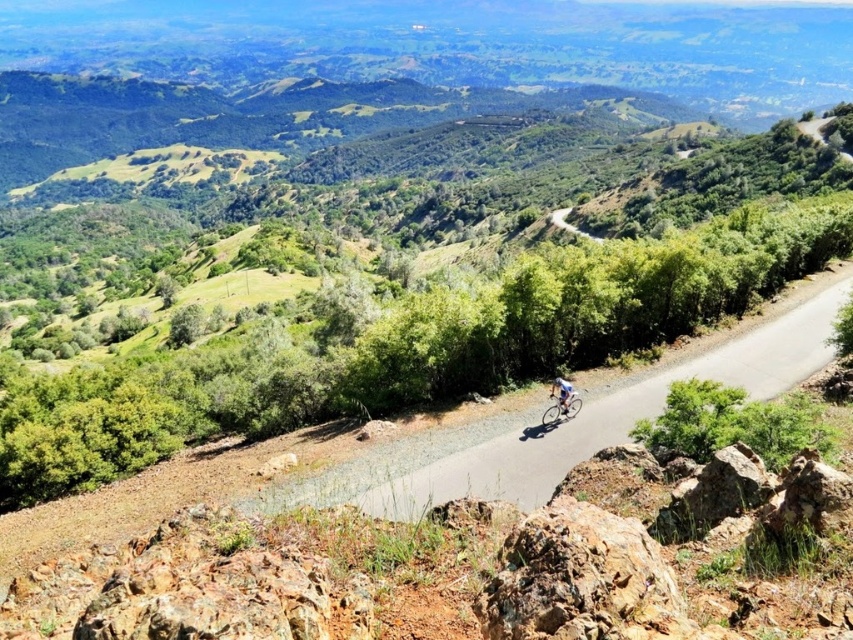
You are a hiker standing at the top of the hill looking down. You see the asphalt road at center and the light blue fabric cyclist at center. Which object appears larger in the scene?

The asphalt road at center appears larger because it is much taller than the light blue fabric cyclist at center.

You are a photographer trying to capture the cyclist and the frame in the scene. According to the image, where is the shiny blue frame at center located relative to the light blue fabric cyclist at center?

The shiny blue frame at center is located to the left of the light blue fabric cyclist at center.